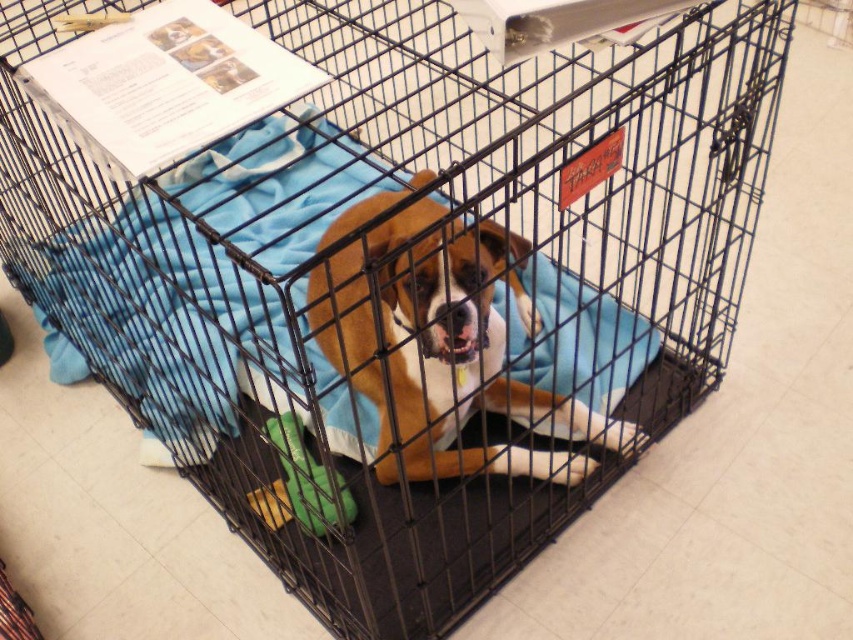
Question: Which point appears farthest from the camera in this image?

Choices:
 (A) (345, 314)
 (B) (296, 481)
 (C) (141, 308)

Answer: (C)

Question: Which point is farther to the camera?

Choices:
 (A) (416, 371)
 (B) (287, 476)

Answer: (B)

Question: Considering the relative positions of blue quilted blanket at center and brown matte dog at center in the image provided, where is blue quilted blanket at center located with respect to brown matte dog at center?

Choices:
 (A) left
 (B) right

Answer: (A)

Question: Which object appears closest to the camera in this image?

Choices:
 (A) brown matte dog at center
 (B) blue quilted blanket at center

Answer: (B)

Question: Is blue quilted blanket at center above green fabric toy at lower center?

Choices:
 (A) no
 (B) yes

Answer: (B)

Question: In this image, where is blue quilted blanket at center located relative to green fabric toy at lower center?

Choices:
 (A) left
 (B) right

Answer: (A)